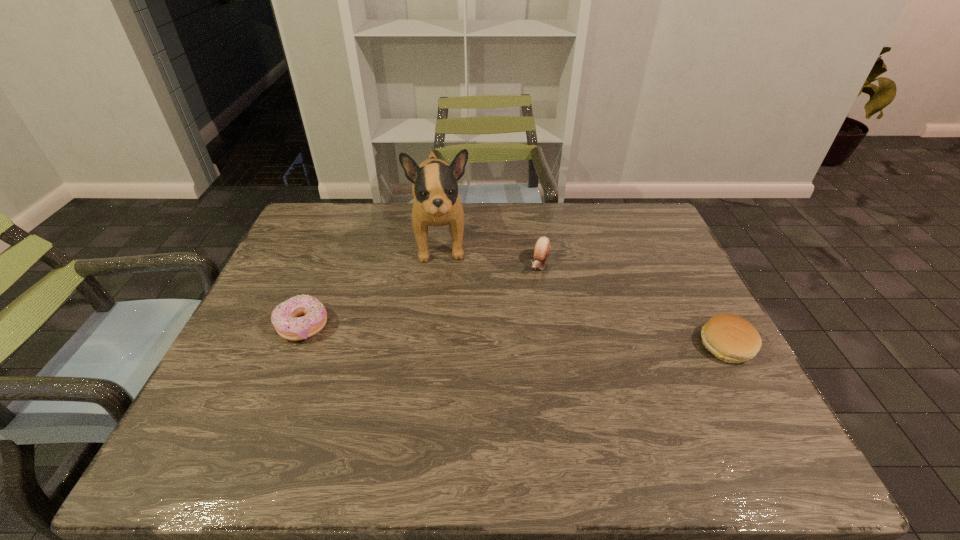
This screenshot has width=960, height=540. In order to click on vacant area situated 0.330m on the front-facing side of the second object from right to left in this screenshot , I will do `click(497, 364)`.

Find the location of a particular element. The image size is (960, 540). blank area located at the face of the puppy is located at coordinates (449, 367).

Locate an element on the screen. This screenshot has height=540, width=960. vacant point located at the face of the puppy is located at coordinates (445, 326).

At what (x,y) coordinates should I click in order to perform the action: click on vacant space located at the face of the puppy. Please return your answer as a coordinate pair (x, y). Looking at the image, I should click on (451, 381).

Locate an element on the screen. object situated at the far edge is located at coordinates (436, 202).

Identify the location of object positioned at the left edge. This screenshot has width=960, height=540. (286, 319).

Where is `object that is positioned at the right edge`? This screenshot has width=960, height=540. object that is positioned at the right edge is located at coordinates (731, 338).

Identify the location of vacant space at the far edge. This screenshot has height=540, width=960. (450, 245).

You are a GUI agent. You are given a task and a screenshot of the screen. Output one action in this format:
    pyautogui.click(x=<x>, y=<y>)
    Task: Click on the vacant space at the left edge of the desktop
    This screenshot has width=960, height=540.
    Given the screenshot: What is the action you would take?
    pyautogui.click(x=290, y=247)

Where is `vacant region at the right edge of the desktop`? Image resolution: width=960 pixels, height=540 pixels. vacant region at the right edge of the desktop is located at coordinates (666, 275).